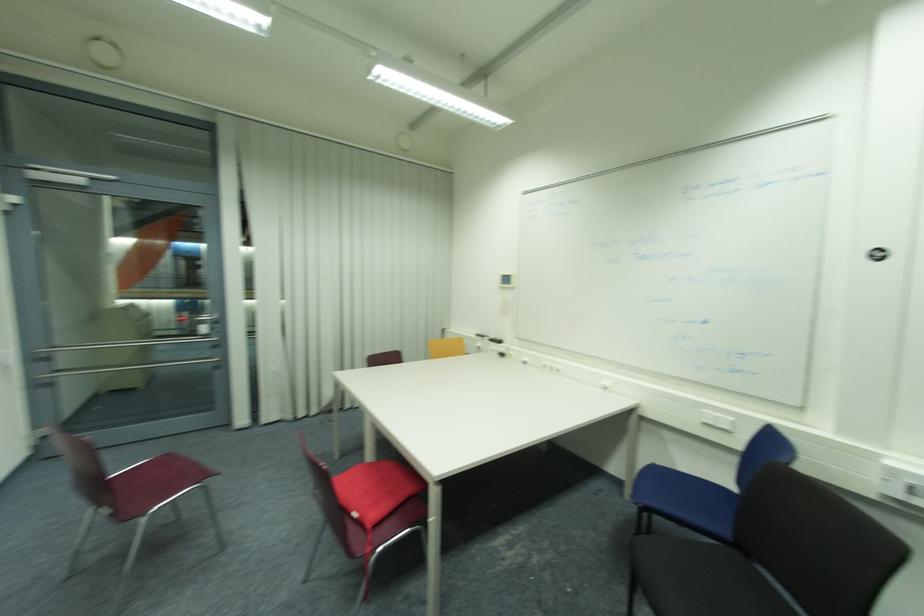
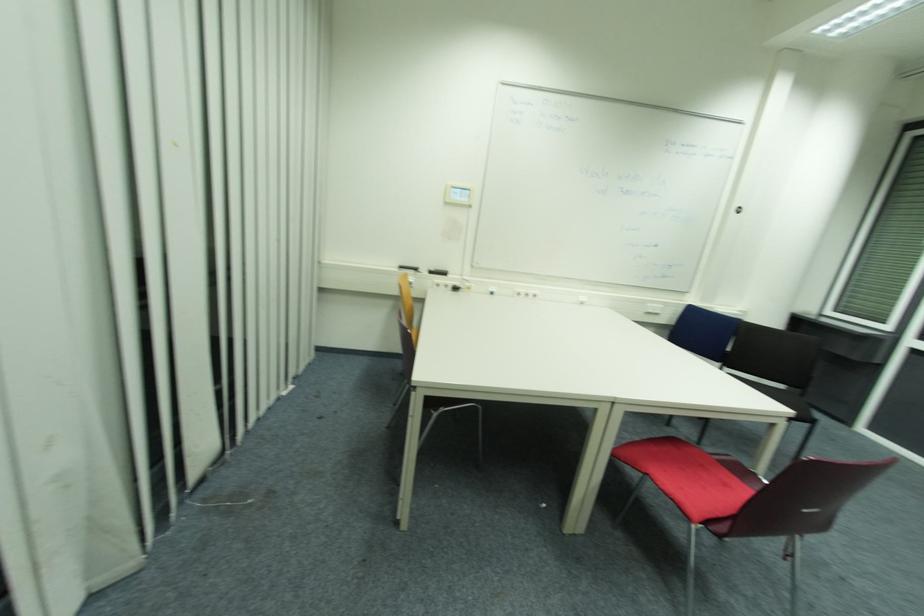
Find the pixel in the second image that matches [506,355] in the first image.

(458, 290)